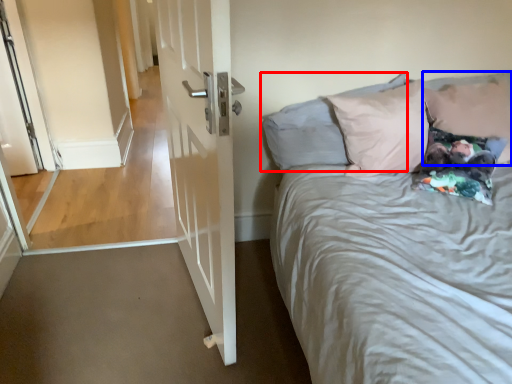
Question: Which object is further to the camera taking this photo, pillow (highlighted by a red box) or pillow (highlighted by a blue box)?

Choices:
 (A) pillow
 (B) pillow

Answer: (B)